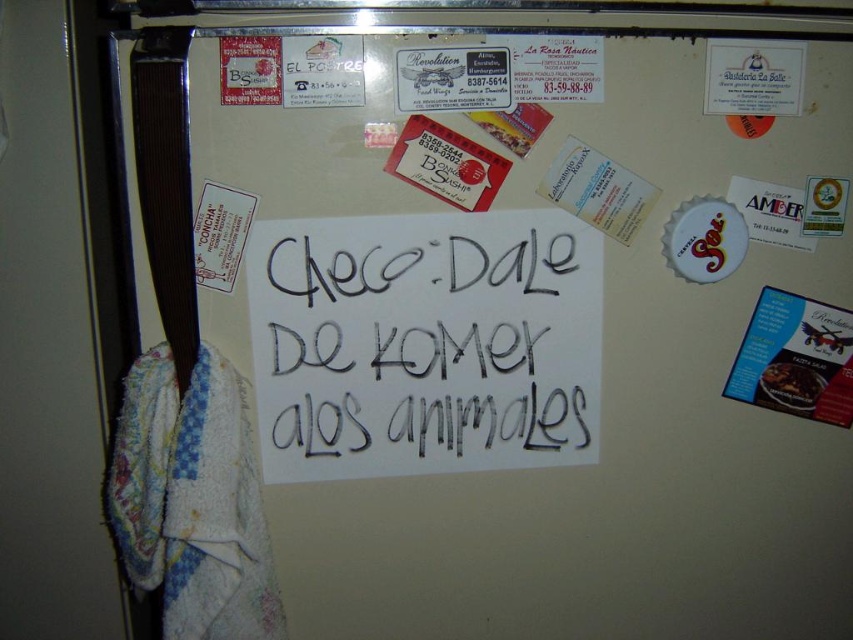
Question: Which point appears farthest from the camera in this image?

Choices:
 (A) (236, 577)
 (B) (796, 396)
 (C) (347, 321)

Answer: (B)

Question: Where is white paper at center located in relation to white fluffy towel at left in the image?

Choices:
 (A) below
 (B) above

Answer: (B)

Question: Among these points, which one is nearest to the camera?

Choices:
 (A) (143, 483)
 (B) (778, 371)

Answer: (A)

Question: Is white paper at center bigger than white fluffy towel at left?

Choices:
 (A) no
 (B) yes

Answer: (B)

Question: Considering the relative positions of white fluffy towel at left and black glossy food at upper right in the image provided, where is white fluffy towel at left located with respect to black glossy food at upper right?

Choices:
 (A) below
 (B) above

Answer: (A)

Question: Which object is the farthest from the black glossy food at upper right?

Choices:
 (A) white fluffy towel at left
 (B) white paper at center

Answer: (A)